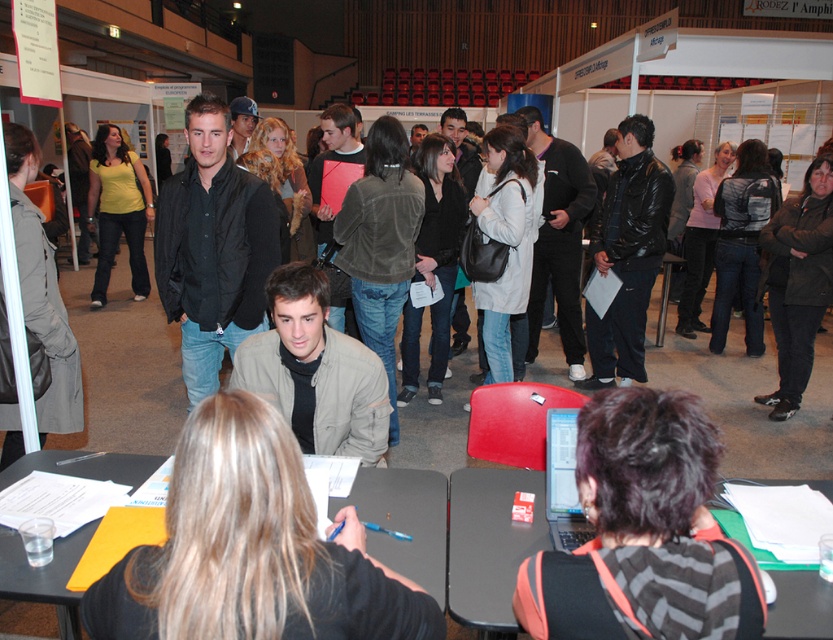
Between black plastic table at lower right and black plastic table at center, which one appears on the right side from the viewer's perspective?

From the viewer's perspective, black plastic table at lower right appears more on the right side.

Looking at this image, does black plastic table at lower right have a larger size compared to black plastic table at center?

No.

Locate an element on the screen. The height and width of the screenshot is (640, 833). black plastic table at lower right is located at coordinates (489, 545).